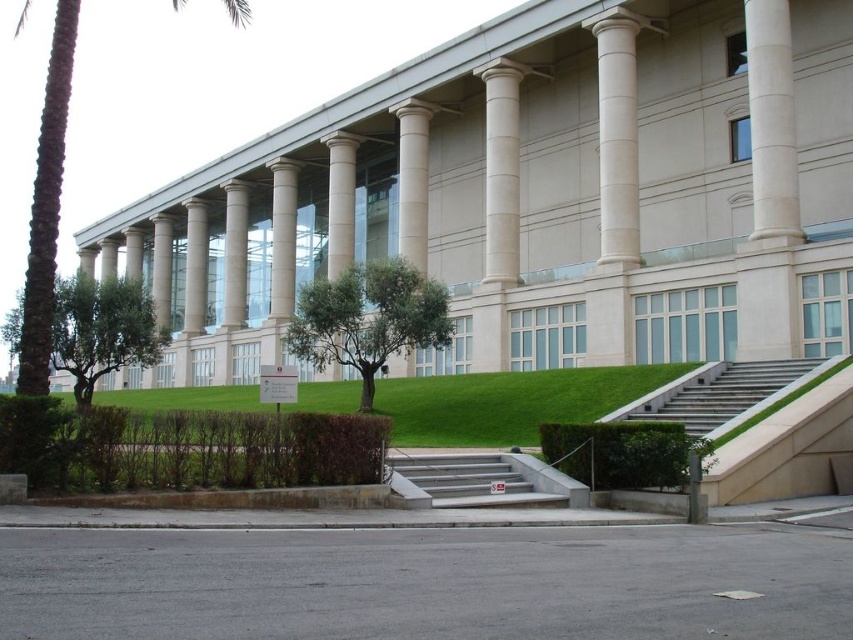
Measure the distance between green grass at lower center and green concrete stairs at lower right.

green grass at lower center and green concrete stairs at lower right are 8.37 meters apart.

Where is `green grass at lower center`? green grass at lower center is located at coordinates (509, 403).

Which is below, green leafy tree at center or smooth concrete stairs at center?

smooth concrete stairs at center is below.

Is green leafy tree at center shorter than smooth concrete stairs at center?

No, green leafy tree at center is not shorter than smooth concrete stairs at center.

Find the location of a particular element. The height and width of the screenshot is (640, 853). green leafy tree at center is located at coordinates (368, 317).

Is green concrete stairs at lower right thinner than green leafy hedge at lower center?

In fact, green concrete stairs at lower right might be wider than green leafy hedge at lower center.

Find the location of a particular element. The height and width of the screenshot is (640, 853). green concrete stairs at lower right is located at coordinates (723, 394).

Image resolution: width=853 pixels, height=640 pixels. I want to click on green concrete stairs at lower right, so click(723, 394).